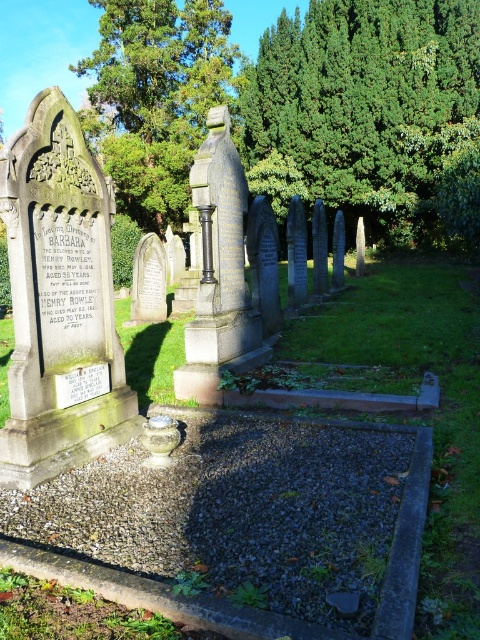
Question: Is green leafy tree at upper center wider than green leafy tree at upper left?

Choices:
 (A) no
 (B) yes

Answer: (A)

Question: Where is green leafy tree at upper center located in relation to green leafy tree at upper left in the image?

Choices:
 (A) right
 (B) left

Answer: (A)

Question: Does green leafy tree at upper center appear on the right side of green leafy tree at upper left?

Choices:
 (A) yes
 (B) no

Answer: (A)